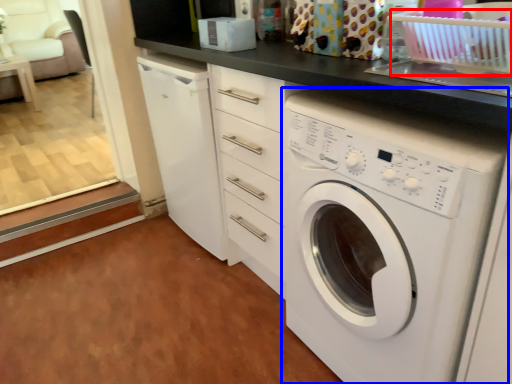
Question: Which point is closer to the camera, basket (highlighted by a red box) or washing machine (highlighted by a blue box)?

Choices:
 (A) basket
 (B) washing machine

Answer: (B)